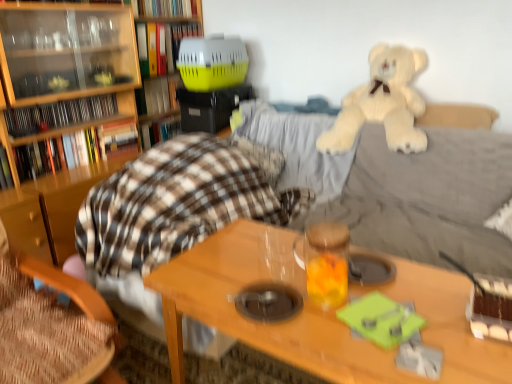
Locate an element on the screen. vacant area that is situated to the right of translucent glass jar at center is located at coordinates click(x=407, y=288).